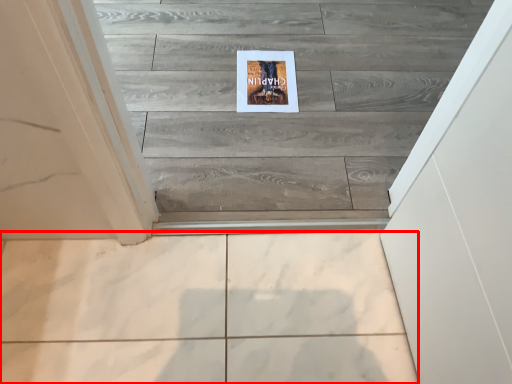
Question: From the image, what is the correct spatial relationship of ceramic tile (annotated by the red box) in relation to postcard?

Choices:
 (A) left
 (B) right

Answer: (A)